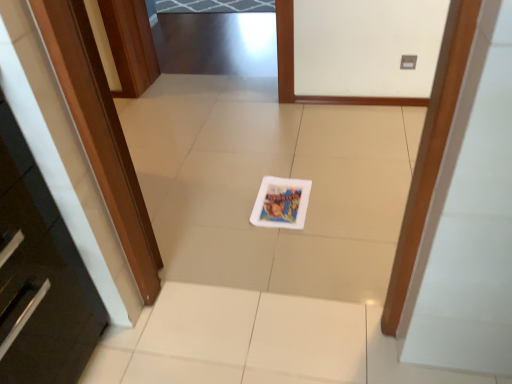
Question: Is wooden door at left situated inside white glossy postcard at center or outside?

Choices:
 (A) inside
 (B) outside

Answer: (B)

Question: Looking at the image, does wooden door at left seem bigger or smaller compared to white glossy postcard at center?

Choices:
 (A) big
 (B) small

Answer: (A)

Question: Relative to white glossy postcard at center, is wooden door at left in front or behind?

Choices:
 (A) behind
 (B) front

Answer: (B)

Question: Is white glossy postcard at center to the left or to the right of wooden door at left in the image?

Choices:
 (A) left
 (B) right

Answer: (B)

Question: In terms of width, does white glossy postcard at center look wider or thinner when compared to wooden door at left?

Choices:
 (A) thin
 (B) wide

Answer: (B)

Question: Do you think white glossy postcard at center is within wooden door at left, or outside of it?

Choices:
 (A) inside
 (B) outside

Answer: (B)

Question: Considering the positions of point (294, 201) and point (109, 147), is point (294, 201) closer or farther from the camera than point (109, 147)?

Choices:
 (A) closer
 (B) farther

Answer: (B)